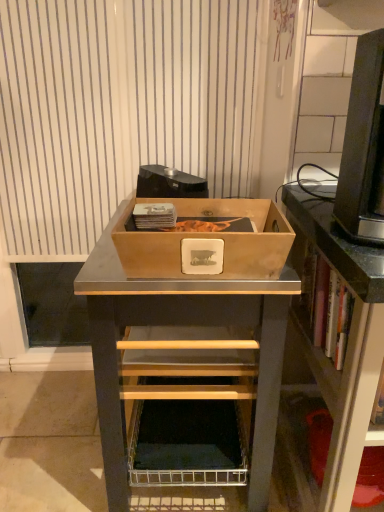
Question: Is the depth of matte black shelf at right greater than that of wooden box at center?

Choices:
 (A) no
 (B) yes

Answer: (A)

Question: From the image's perspective, is matte black shelf at right located above wooden box at center?

Choices:
 (A) no
 (B) yes

Answer: (A)

Question: Is matte black shelf at right directly adjacent to wooden box at center?

Choices:
 (A) no
 (B) yes

Answer: (A)

Question: Is wooden box at center completely or partially inside matte black shelf at right?

Choices:
 (A) yes
 (B) no

Answer: (B)

Question: From the image's perspective, is matte black shelf at right beneath wooden box at center?

Choices:
 (A) yes
 (B) no

Answer: (A)

Question: Visually, is wooden box at center positioned to the left or to the right of black plastic desktop computer at upper right?

Choices:
 (A) left
 (B) right

Answer: (A)

Question: From a real-world perspective, is wooden box at center above or below black plastic desktop computer at upper right?

Choices:
 (A) below
 (B) above

Answer: (A)

Question: In terms of size, does wooden box at center appear bigger or smaller than black plastic desktop computer at upper right?

Choices:
 (A) big
 (B) small

Answer: (A)

Question: From their relative heights in the image, would you say wooden box at center is taller or shorter than black plastic desktop computer at upper right?

Choices:
 (A) short
 (B) tall

Answer: (B)

Question: Considering their positions, is matte black shelf at right located in front of or behind wooden box at center?

Choices:
 (A) front
 (B) behind

Answer: (A)

Question: In terms of height, does matte black shelf at right look taller or shorter compared to wooden box at center?

Choices:
 (A) tall
 (B) short

Answer: (A)

Question: From a real-world perspective, is matte black shelf at right positioned above or below wooden box at center?

Choices:
 (A) below
 (B) above

Answer: (A)

Question: Choose the correct answer: Is matte black shelf at right inside wooden box at center or outside it?

Choices:
 (A) outside
 (B) inside

Answer: (A)

Question: In the image, is white striped curtain at upper center positioned in front of or behind wooden box at center?

Choices:
 (A) front
 (B) behind

Answer: (B)

Question: Considering the positions of white striped curtain at upper center and wooden box at center in the image, is white striped curtain at upper center wider or thinner than wooden box at center?

Choices:
 (A) thin
 (B) wide

Answer: (A)